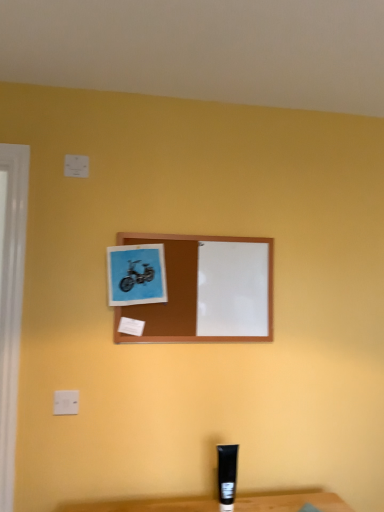
The width and height of the screenshot is (384, 512). I want to click on blue paper at upper center, arranged as the first picture frame when viewed from the left, so click(136, 274).

Could you tell me if brown wooden picture frame at center, acting as the first picture frame starting from the right, is facing blue paper at upper center, which appears as the 2th picture frame when viewed from the right?

Yes, brown wooden picture frame at center, acting as the first picture frame starting from the right, is turned towards blue paper at upper center, which appears as the 2th picture frame when viewed from the right.

From a real-world perspective, is brown wooden picture frame at center, acting as the first picture frame starting from the right, physically located above or below blue paper at upper center, arranged as the first picture frame when viewed from the left?

In terms of real-world spatial position, brown wooden picture frame at center, acting as the first picture frame starting from the right, is below blue paper at upper center, arranged as the first picture frame when viewed from the left.

Is brown wooden picture frame at center, acting as the first picture frame starting from the right, shorter than blue paper at upper center, arranged as the first picture frame when viewed from the left?

In fact, brown wooden picture frame at center, acting as the first picture frame starting from the right, may be taller than blue paper at upper center, arranged as the first picture frame when viewed from the left.

Between brown wooden picture frame at center, acting as the first picture frame starting from the right, and blue paper at upper center, arranged as the first picture frame when viewed from the left, which one has larger size?

brown wooden picture frame at center, acting as the first picture frame starting from the right.

How distant is brown wooden picture frame at center, acting as the first picture frame starting from the right, from white plastic electric outlet at upper left?

The distance of brown wooden picture frame at center, acting as the first picture frame starting from the right, from white plastic electric outlet at upper left is 57.84 centimeters.

Locate an element on the screen. electric outlet in front of the brown wooden picture frame at center, which is the 2th picture frame in left-to-right order is located at coordinates (66, 402).

Is brown wooden picture frame at center, which is the 2th picture frame in left-to-right order, completely or partially outside of white plastic electric outlet at upper left?

Yes, brown wooden picture frame at center, which is the 2th picture frame in left-to-right order, is outside of white plastic electric outlet at upper left.

Between brown wooden picture frame at center, acting as the first picture frame starting from the right, and white plastic electric outlet at upper left, which one appears on the left side from the viewer's perspective?

Positioned to the left is white plastic electric outlet at upper left.

Is blue paper at upper center, which appears as the 2th picture frame when viewed from the right, not close to brown wooden picture frame at center, acting as the first picture frame starting from the right?

No, blue paper at upper center, which appears as the 2th picture frame when viewed from the right, is not far from brown wooden picture frame at center, acting as the first picture frame starting from the right.

How different are the orientations of blue paper at upper center, arranged as the first picture frame when viewed from the left, and brown wooden picture frame at center, which is the 2th picture frame in left-to-right order, in degrees?

The angle between the facing direction of blue paper at upper center, arranged as the first picture frame when viewed from the left, and the facing direction of brown wooden picture frame at center, which is the 2th picture frame in left-to-right order, is 0.012 degrees.

From a real-world perspective, which is physically below, blue paper at upper center, arranged as the first picture frame when viewed from the left, or brown wooden picture frame at center, which is the 2th picture frame in left-to-right order?

brown wooden picture frame at center, which is the 2th picture frame in left-to-right order, is physically lower.

Considering the positions of objects blue paper at upper center, which appears as the 2th picture frame when viewed from the right, and brown wooden picture frame at center, acting as the first picture frame starting from the right, in the image provided, who is in front, blue paper at upper center, which appears as the 2th picture frame when viewed from the right, or brown wooden picture frame at center, acting as the first picture frame starting from the right,?

blue paper at upper center, which appears as the 2th picture frame when viewed from the right, is more forward.

Does white plastic electric outlet at upper left turn towards blue paper at upper center, arranged as the first picture frame when viewed from the left?

No, white plastic electric outlet at upper left is not facing towards blue paper at upper center, arranged as the first picture frame when viewed from the left.

Is white plastic electric outlet at upper left at the right side of blue paper at upper center, arranged as the first picture frame when viewed from the left?

In fact, white plastic electric outlet at upper left is to the left of blue paper at upper center, arranged as the first picture frame when viewed from the left.

Can you confirm if white plastic electric outlet at upper left is thinner than blue paper at upper center, arranged as the first picture frame when viewed from the left?

Indeed, white plastic electric outlet at upper left has a lesser width compared to blue paper at upper center, arranged as the first picture frame when viewed from the left.

Is white plastic electric outlet at upper left located outside brown wooden picture frame at center, which is the 2th picture frame in left-to-right order?

white plastic electric outlet at upper left is positioned outside brown wooden picture frame at center, which is the 2th picture frame in left-to-right order.

Between white plastic electric outlet at upper left and brown wooden picture frame at center, acting as the first picture frame starting from the right, which one has larger size?

brown wooden picture frame at center, acting as the first picture frame starting from the right, is bigger.

From the image's perspective, is white plastic electric outlet at upper left under brown wooden picture frame at center, acting as the first picture frame starting from the right?

Yes, from the image's perspective, white plastic electric outlet at upper left is beneath brown wooden picture frame at center, acting as the first picture frame starting from the right.

Does blue paper at upper center, arranged as the first picture frame when viewed from the left, have a greater width compared to white plastic electric outlet at upper left?

Yes.

Is blue paper at upper center, arranged as the first picture frame when viewed from the left, not near white plastic electric outlet at upper left?

They are positioned close to each other.

Is blue paper at upper center, which appears as the 2th picture frame when viewed from the right, bigger than white plastic electric outlet at upper left?

Indeed, blue paper at upper center, which appears as the 2th picture frame when viewed from the right, has a larger size compared to white plastic electric outlet at upper left.

Who is shorter, blue paper at upper center, arranged as the first picture frame when viewed from the left, or white plastic electric outlet at upper left?

white plastic electric outlet at upper left.

Identify the location of picture frame that appears in front of the brown wooden picture frame at center, acting as the first picture frame starting from the right. (136, 274).

The height and width of the screenshot is (512, 384). I want to click on the 2nd picture frame behind the white plastic electric outlet at upper left, so coord(198,286).

Looking at the image, which one is located further to white plastic electric outlet at upper left, blue paper at upper center, arranged as the first picture frame when viewed from the left, or brown wooden picture frame at center, which is the 2th picture frame in left-to-right order?

Among the two, brown wooden picture frame at center, which is the 2th picture frame in left-to-right order, is located further to white plastic electric outlet at upper left.

From the image, which object appears to be nearer to blue paper at upper center, which appears as the 2th picture frame when viewed from the right, white plastic electric outlet at upper left or brown wooden picture frame at center, which is the 2th picture frame in left-to-right order?

Based on the image, brown wooden picture frame at center, which is the 2th picture frame in left-to-right order, appears to be nearer to blue paper at upper center, which appears as the 2th picture frame when viewed from the right.

Based on their spatial positions, is brown wooden picture frame at center, which is the 2th picture frame in left-to-right order, or blue paper at upper center, which appears as the 2th picture frame when viewed from the right, closer to white plastic electric outlet at upper left?

blue paper at upper center, which appears as the 2th picture frame when viewed from the right, is closer to white plastic electric outlet at upper left.

Estimate the real-world distances between objects in this image. Which object is closer to brown wooden picture frame at center, which is the 2th picture frame in left-to-right order, white plastic electric outlet at upper left or blue paper at upper center, arranged as the first picture frame when viewed from the left?

The object closer to brown wooden picture frame at center, which is the 2th picture frame in left-to-right order, is blue paper at upper center, arranged as the first picture frame when viewed from the left.

Estimate the real-world distances between objects in this image. Which object is further from brown wooden picture frame at center, acting as the first picture frame starting from the right, blue paper at upper center, which appears as the 2th picture frame when viewed from the right, or white plastic electric outlet at upper left?

The object further to brown wooden picture frame at center, acting as the first picture frame starting from the right, is white plastic electric outlet at upper left.

Considering their positions, is brown wooden picture frame at center, which is the 2th picture frame in left-to-right order, positioned further to blue paper at upper center, which appears as the 2th picture frame when viewed from the right, than white plastic electric outlet at upper left?

white plastic electric outlet at upper left is positioned further to the anchor blue paper at upper center, which appears as the 2th picture frame when viewed from the right.

Where is `picture frame that lies between blue paper at upper center, arranged as the first picture frame when viewed from the left, and white plastic electric outlet at upper left from top to bottom`? This screenshot has width=384, height=512. picture frame that lies between blue paper at upper center, arranged as the first picture frame when viewed from the left, and white plastic electric outlet at upper left from top to bottom is located at coordinates (198, 286).